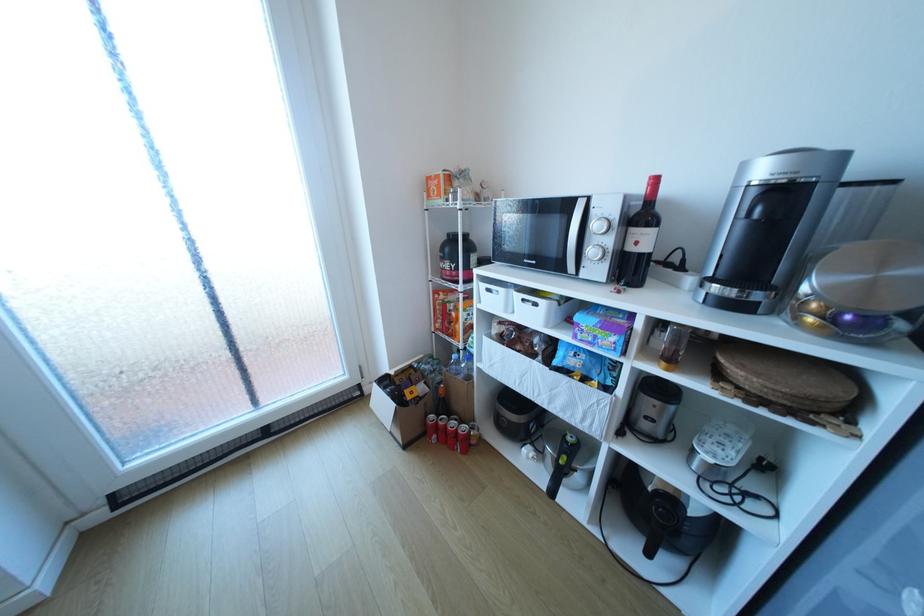
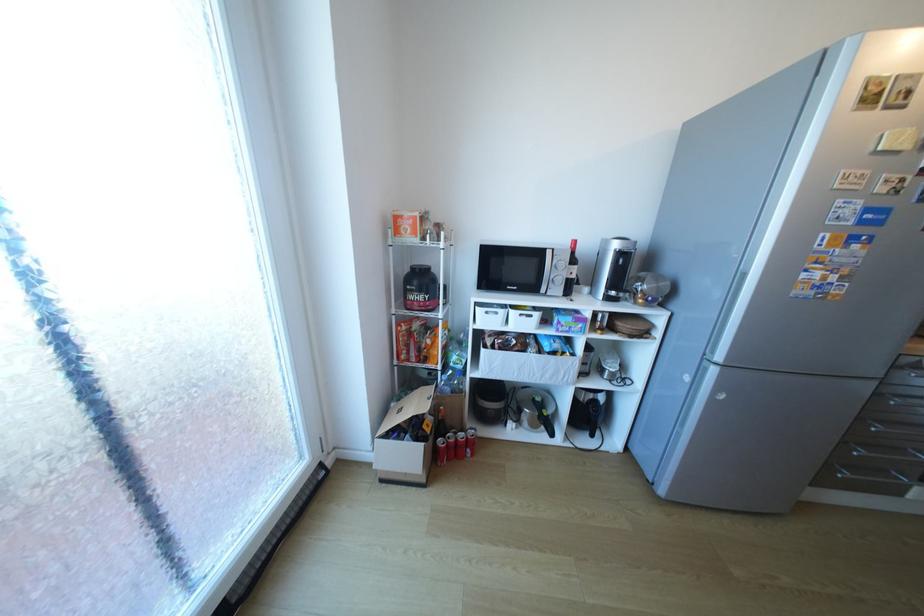
Find the pixel in the second image that matches (459,427) in the first image.

(469, 439)